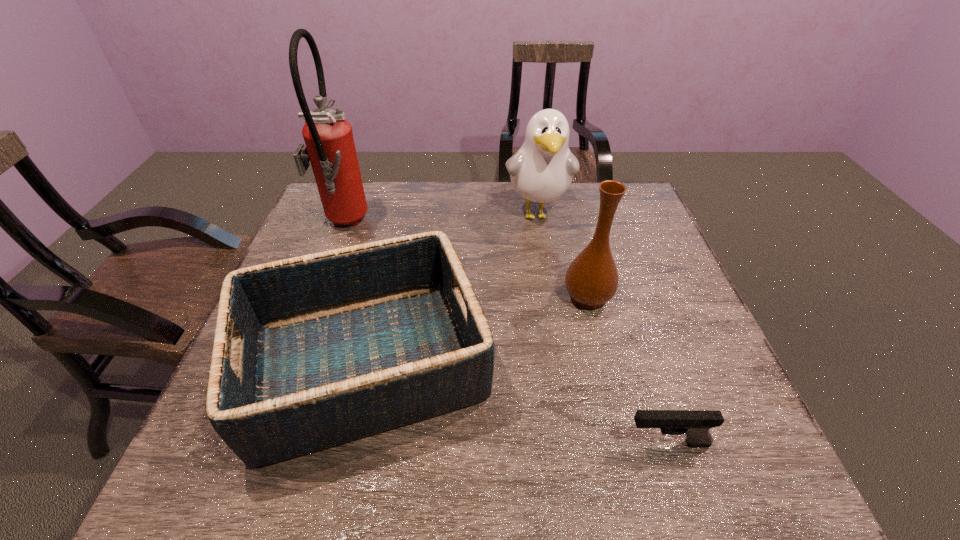
Locate an element on the screen. The height and width of the screenshot is (540, 960). vacant space that is in between the basket and the pistol is located at coordinates (516, 403).

Locate an element on the screen. Image resolution: width=960 pixels, height=540 pixels. unoccupied area between the pistol and the vase is located at coordinates (627, 370).

This screenshot has height=540, width=960. I want to click on vacant area that lies between the vase and the shortest object, so click(x=627, y=370).

I want to click on free space between the gull and the pistol, so click(x=602, y=328).

Find the location of a particular element. This screenshot has height=540, width=960. free space between the fire extinguisher and the vase is located at coordinates (465, 261).

Find the location of a particular element. empty space that is in between the vase and the gull is located at coordinates (563, 255).

In order to click on the fourth closest object to the tallest object in this screenshot , I will do `click(695, 424)`.

Identify the location of the second closest object to the pistol. The width and height of the screenshot is (960, 540). click(591, 280).

This screenshot has height=540, width=960. Find the location of `vacant region that satisfies the following two spatial constraints: 1. at the nozzle of the fire extinguisher; 2. on the left side of the vase`. vacant region that satisfies the following two spatial constraints: 1. at the nozzle of the fire extinguisher; 2. on the left side of the vase is located at coordinates (315, 298).

Identify the location of free space in the image that satisfies the following two spatial constraints: 1. at the nozzle of the vase; 2. on the right side of the tallest object. (315, 298).